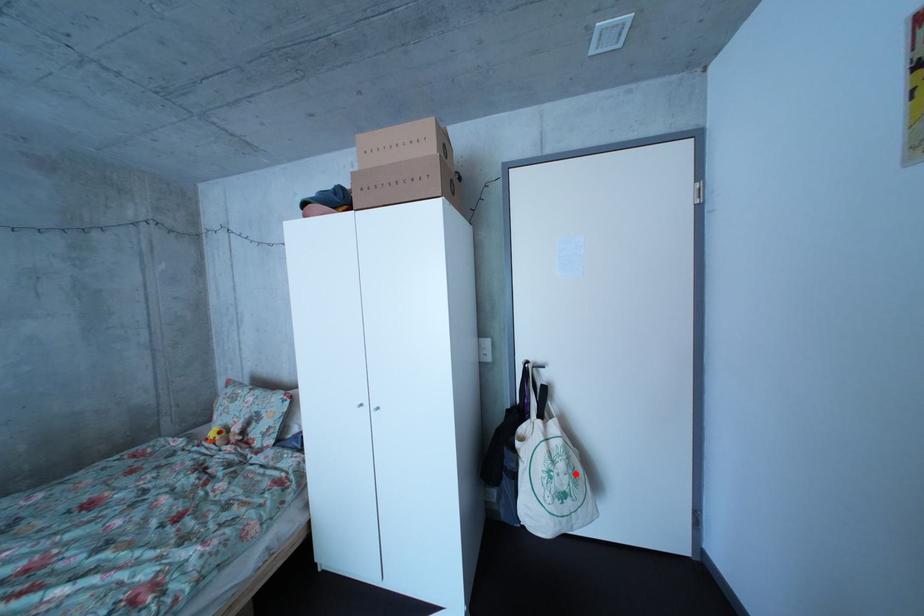
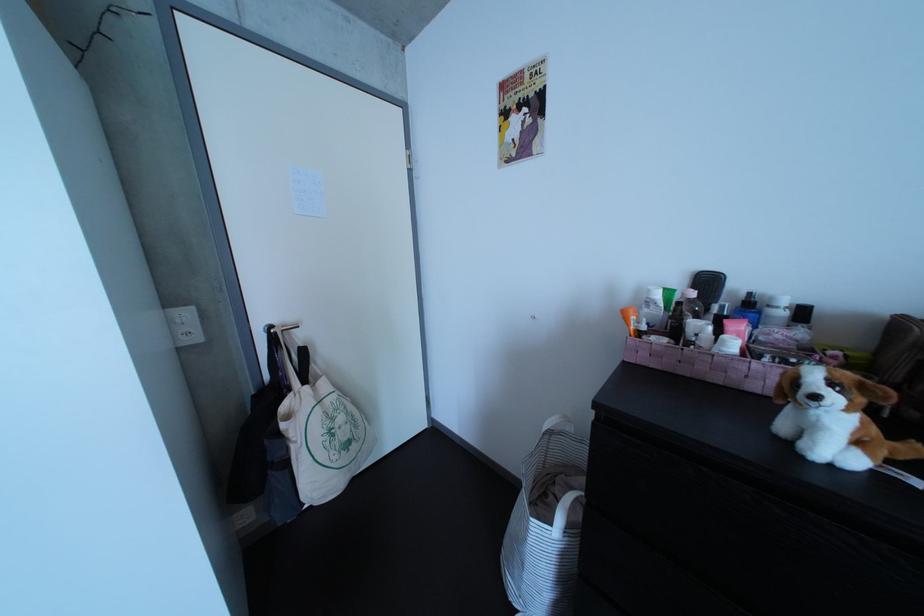
Question: I am providing you with two images of the same scene from different viewpoints. Image1 has a red point marked. In image2, the corresponding 3D location appears at what relative position? Reply with the corresponding letter.

Choices:
 (A) Closer
 (B) Farther

Answer: (A)